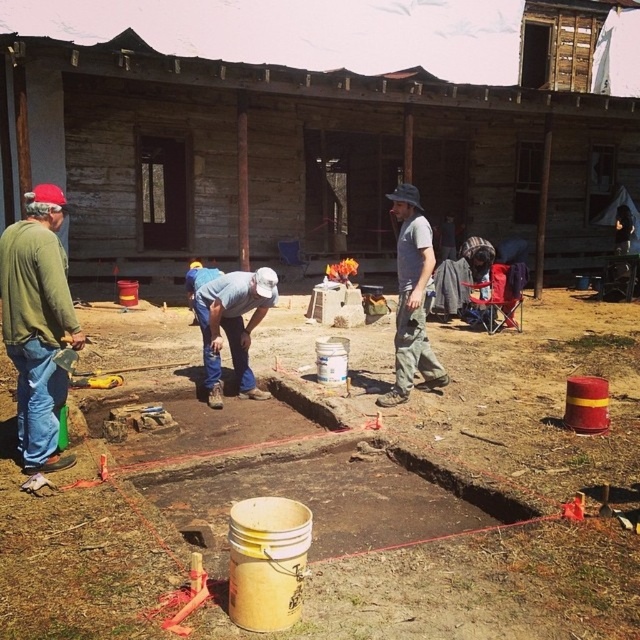
Question: Is wooden hut at center thinner than green matte shirt at left?

Choices:
 (A) no
 (B) yes

Answer: (A)

Question: Which object is farther from the camera taking this photo?

Choices:
 (A) denim jeans at center
 (B) yellow plastic bucket at center
 (C) gray cotton shirt at center

Answer: (A)

Question: Which point is farther from the camera taking this photo?

Choices:
 (A) (134, 566)
 (B) (404, 348)

Answer: (B)

Question: Which is farther from the green matte shirt at left?

Choices:
 (A) denim jeans at center
 (B) gray cotton shirt at center

Answer: (B)

Question: Observing the image, what is the correct spatial positioning of yellow plastic bucket at center in reference to green matte shirt at left?

Choices:
 (A) left
 (B) right

Answer: (B)

Question: In this image, where is wooden hut at center located relative to green matte shirt at left?

Choices:
 (A) above
 (B) below

Answer: (A)